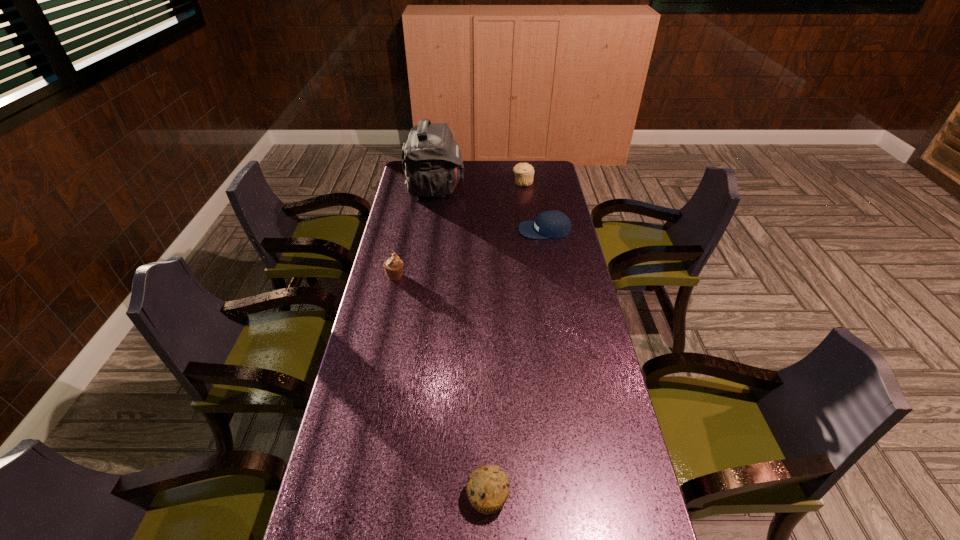
The width and height of the screenshot is (960, 540). Identify the location of free space between the third object from right to left and the shoulder bag. (461, 342).

The image size is (960, 540). I want to click on free point between the second muffin from right to left and the baseball cap, so click(516, 363).

Find the location of a particular element. This screenshot has height=540, width=960. free area in between the shoulder bag and the third farthest object is located at coordinates (490, 210).

Identify the location of vacant area that lies between the third object from right to left and the tallest object. pos(461,342).

Locate an element on the screen. vacant area that lies between the second nearest muffin and the farthest muffin is located at coordinates (459, 229).

Identify which object is located as the fourth nearest to the baseball cap. Please provide its 2D coordinates. Your answer should be formatted as a tuple, i.e. [(x, y)], where the tuple contains the x and y coordinates of a point satisfying the conditions above.

[(487, 488)]

You are a GUI agent. You are given a task and a screenshot of the screen. Output one action in this format:
    pyautogui.click(x=<x>, y=<y>)
    Task: Click on the closest object relative to the third nearest object
    Image resolution: width=960 pixels, height=540 pixels.
    Given the screenshot: What is the action you would take?
    pyautogui.click(x=432, y=161)

Identify which muffin is the closest to the shoulder bag. Please provide its 2D coordinates. Your answer should be formatted as a tuple, i.e. [(x, y)], where the tuple contains the x and y coordinates of a point satisfying the conditions above.

[(524, 172)]

Identify which muffin is the second closest to the farthest muffin. Please provide its 2D coordinates. Your answer should be formatted as a tuple, i.e. [(x, y)], where the tuple contains the x and y coordinates of a point satisfying the conditions above.

[(487, 488)]

The height and width of the screenshot is (540, 960). Find the location of `vacant area in the image that satisfies the following two spatial constraints: 1. on the open flap of the shoulder bag; 2. on the front side of the fourth farthest object`. vacant area in the image that satisfies the following two spatial constraints: 1. on the open flap of the shoulder bag; 2. on the front side of the fourth farthest object is located at coordinates (422, 275).